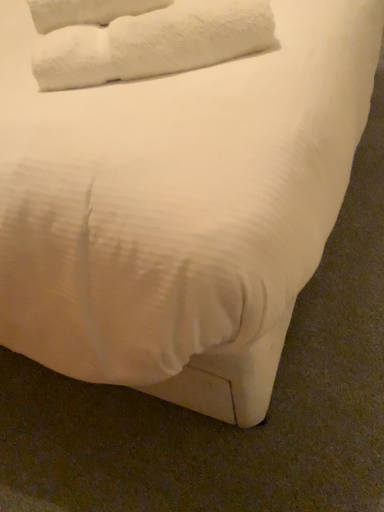
Question: Should I look upward or downward to see white fluffy towel at upper left?

Choices:
 (A) up
 (B) down

Answer: (A)